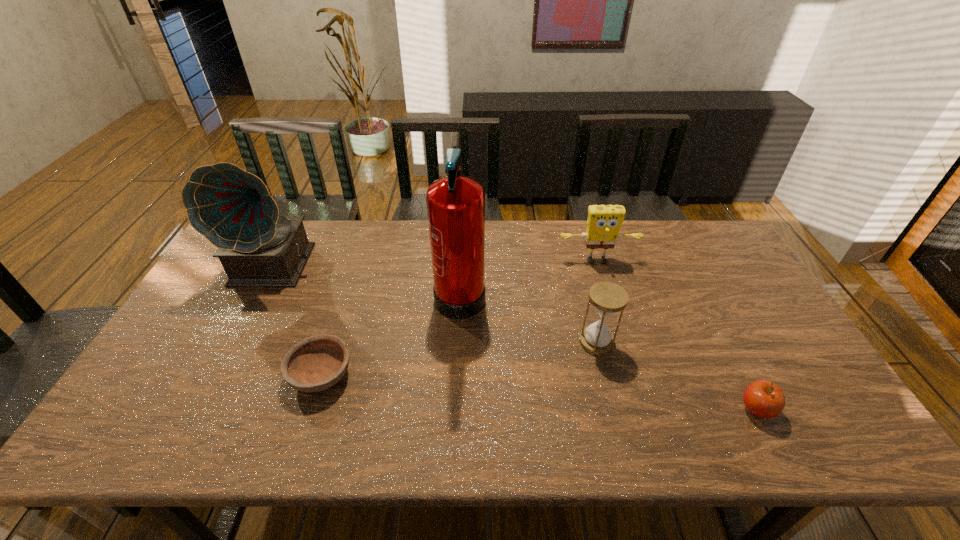
You are a GUI agent. You are given a task and a screenshot of the screen. Output one action in this format:
    pyautogui.click(x=<x>, y=<y>)
    Task: Click on the vacant space located on the left of the fourth object from right to left
    
    Given the screenshot: What is the action you would take?
    pyautogui.click(x=367, y=291)

Identify the location of vacant area located on the horn of the fifth shortest object. The image size is (960, 540). (209, 394).

Where is `vacant area located on the face of the sponge`? The width and height of the screenshot is (960, 540). vacant area located on the face of the sponge is located at coordinates (624, 350).

Where is `vacant point located on the back of the hourglass`? vacant point located on the back of the hourglass is located at coordinates (575, 254).

Locate an element on the screen. This screenshot has width=960, height=540. vacant space situated 0.070m on the right of the second shortest object is located at coordinates (804, 409).

Locate an element on the screen. free spot located 0.380m on the right of the shortest object is located at coordinates [502, 375].

You are a GUI agent. You are given a task and a screenshot of the screen. Output one action in this format:
    pyautogui.click(x=<x>, y=<y>)
    Task: Click on the fire extinguisher situated at the far edge
    Image resolution: width=960 pixels, height=540 pixels.
    Given the screenshot: What is the action you would take?
    pyautogui.click(x=455, y=204)

Locate an element on the screen. Image resolution: width=960 pixels, height=540 pixels. record player at the far edge is located at coordinates (233, 209).

At what (x,y) coordinates should I click in order to perform the action: click on sponge that is at the far edge. Please return your answer as a coordinate pair (x, y). Image resolution: width=960 pixels, height=540 pixels. Looking at the image, I should click on (604, 222).

Where is `object situated at the near edge`? object situated at the near edge is located at coordinates (764, 399).